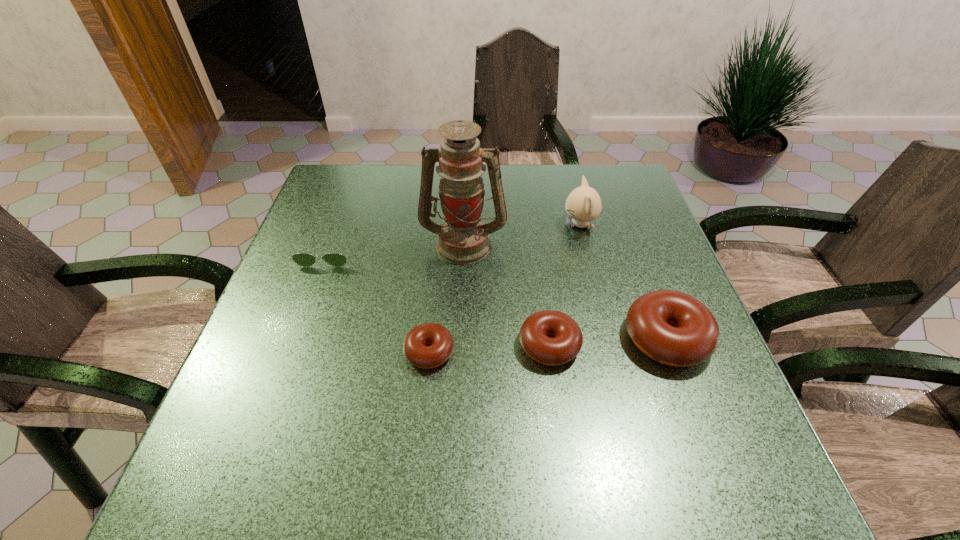
At what (x,y) coordinates should I click in order to perform the action: click on free spot at the near edge of the desktop. Please return your answer as a coordinate pair (x, y). Looking at the image, I should click on (492, 406).

You are a GUI agent. You are given a task and a screenshot of the screen. Output one action in this format:
    pyautogui.click(x=<x>, y=<y>)
    Task: Click on the vacant space at the left edge of the desktop
    The width and height of the screenshot is (960, 540).
    Given the screenshot: What is the action you would take?
    pyautogui.click(x=306, y=310)

Locate an element on the screen. This screenshot has width=960, height=540. vacant space at the right edge is located at coordinates (637, 235).

You are a GUI agent. You are given a task and a screenshot of the screen. Output one action in this format:
    pyautogui.click(x=<x>, y=<y>)
    Task: Click on the free space at the far left corner of the desktop
    This screenshot has width=960, height=540.
    Given the screenshot: What is the action you would take?
    pyautogui.click(x=344, y=169)

In the image, there is a desktop. At what (x,y) coordinates should I click in order to perform the action: click on vacant area at the far right corner. Please return your answer as a coordinate pair (x, y). Looking at the image, I should click on (585, 173).

The width and height of the screenshot is (960, 540). What are the coordinates of `free space between the leftmost object and the second tallest doughnut` in the screenshot? It's located at (439, 298).

Image resolution: width=960 pixels, height=540 pixels. In order to click on free spot between the second doughnut from left to right and the leftmost doughnut in this screenshot , I will do `click(490, 348)`.

What are the coordinates of `empty location between the second tallest doughnut and the oil lamp` in the screenshot? It's located at click(x=507, y=294).

The width and height of the screenshot is (960, 540). Find the location of `free space between the shortest doughnut and the leftmost object`. free space between the shortest doughnut and the leftmost object is located at coordinates (379, 301).

The height and width of the screenshot is (540, 960). Find the location of `vacant space that is in between the oil lamp and the leftmost doughnut`. vacant space that is in between the oil lamp and the leftmost doughnut is located at coordinates pyautogui.click(x=446, y=298).